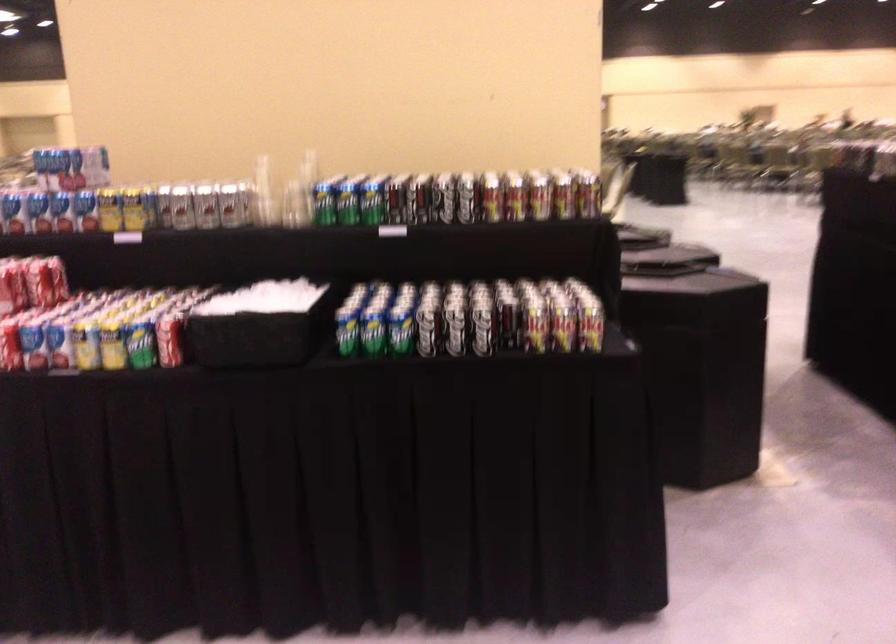
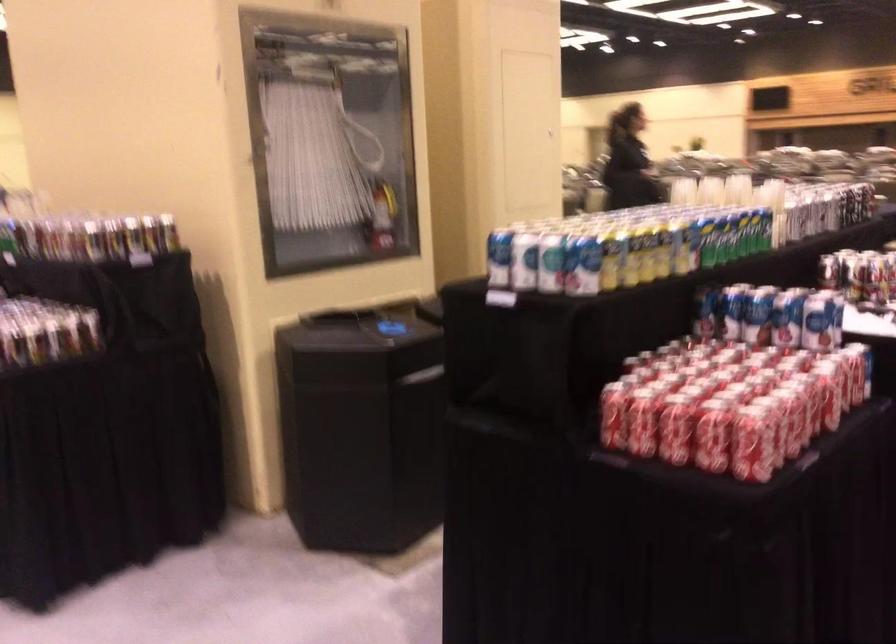
Locate, in the second image, the point that corresponds to [591,194] in the first image.

(131, 254)